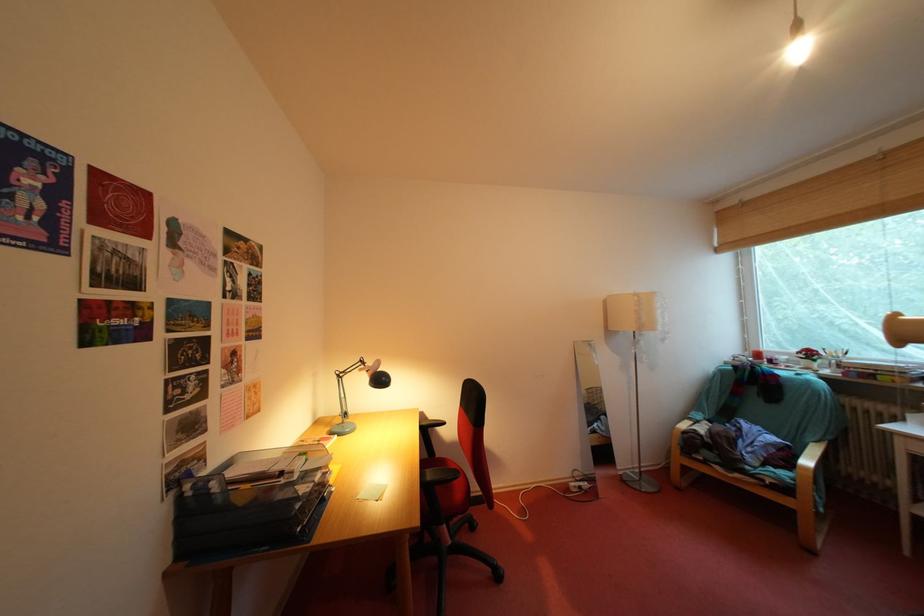
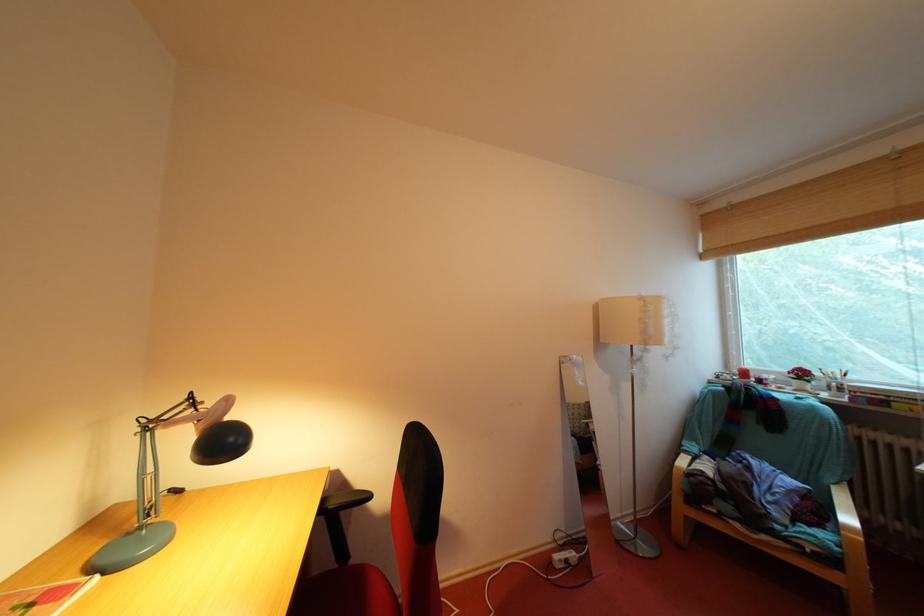
Question: The images are taken continuously from a first-person perspective. In which direction are you moving?

Choices:
 (A) Left
 (B) Right
 (C) Forward
 (D) Backward

Answer: (C)